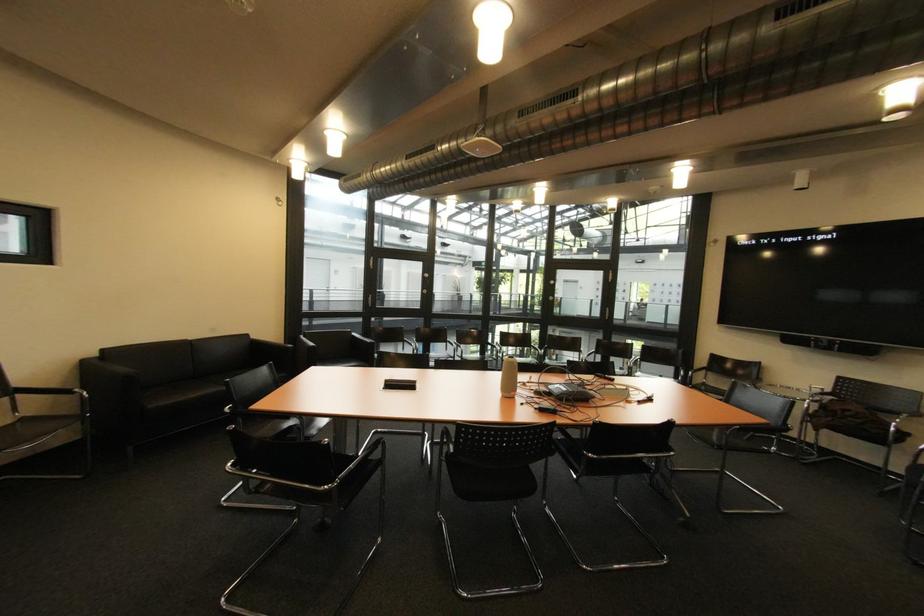
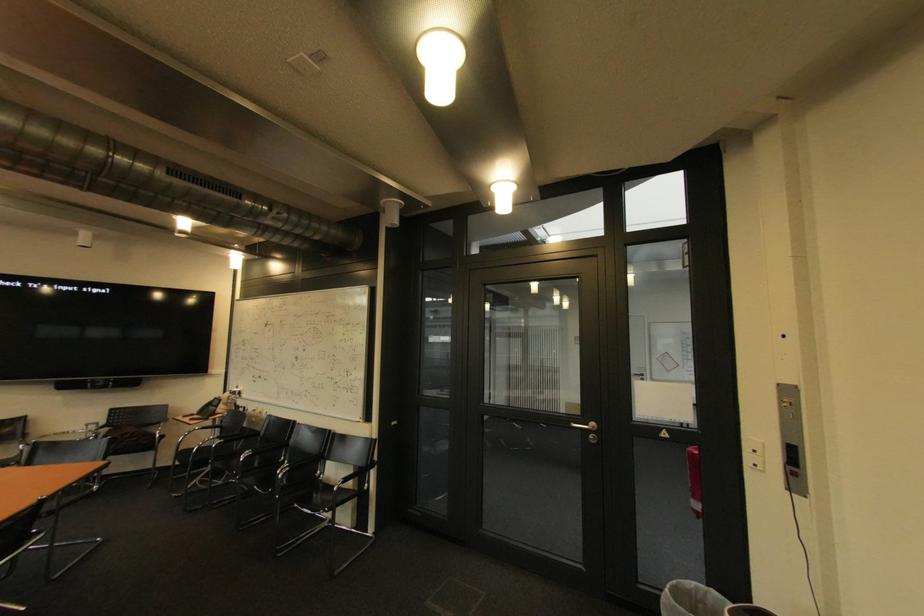
The point at (x=888, y=415) is marked in the first image. Where is the corresponding point in the second image?

(152, 430)